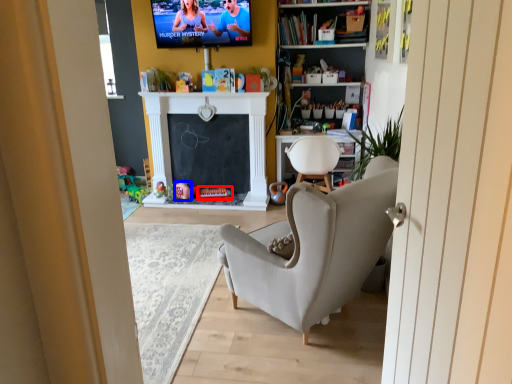
Question: Which object appears farthest to the camera in this image, toy (highlighted by a red box) or toy (highlighted by a blue box)?

Choices:
 (A) toy
 (B) toy

Answer: (A)